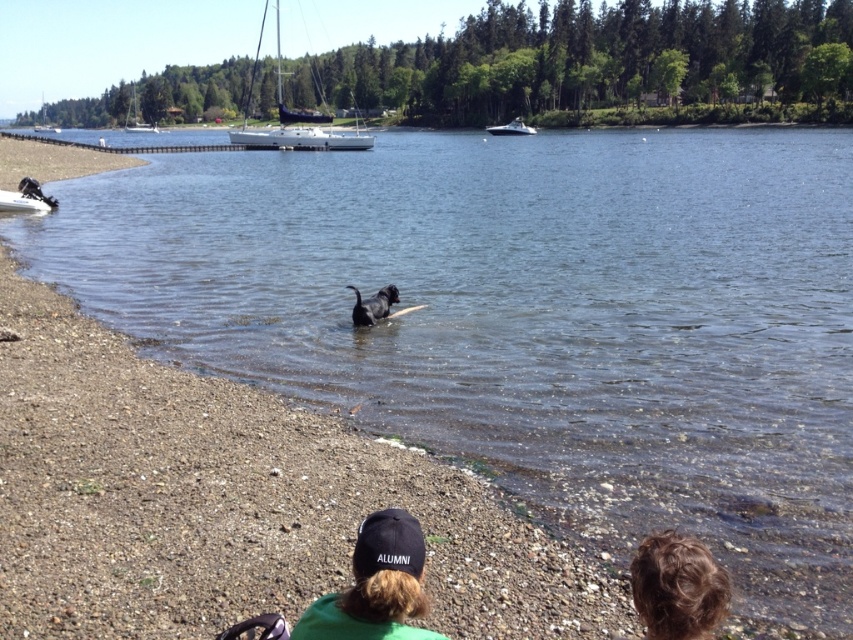
Question: Is black fabric cap at lower center smaller than brown curly hair at lower right?

Choices:
 (A) no
 (B) yes

Answer: (A)

Question: Estimate the real-world distances between objects in this image. Which object is closer to the black sailboat at upper center?

Choices:
 (A) white plastic boat at center
 (B) black matte dog at center
 (C) white sailboat at upper left
 (D) black fabric cap at lower center

Answer: (A)

Question: From the image, what is the correct spatial relationship of black fabric cap at lower center in relation to black sailboat at upper center?

Choices:
 (A) right
 (B) left

Answer: (A)

Question: Which is farther from the black fabric cap at lower center?

Choices:
 (A) white plastic boat at center
 (B) black sailboat at upper center

Answer: (A)

Question: Which point is closer to the camera?

Choices:
 (A) (691, 628)
 (B) (131, 125)
 (C) (389, 301)

Answer: (A)

Question: Is brown curly hair at lower right positioned before white plastic boat at center?

Choices:
 (A) yes
 (B) no

Answer: (A)